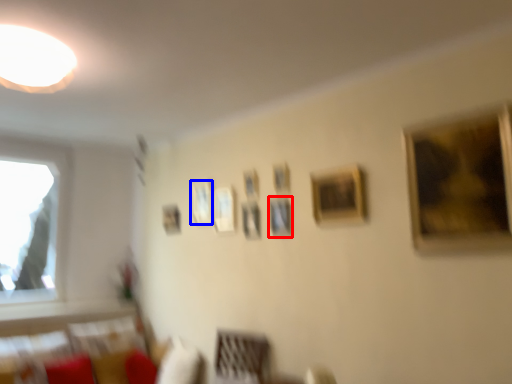
Question: Which point is further to the camera, picture frame (highlighted by a red box) or picture frame (highlighted by a blue box)?

Choices:
 (A) picture frame
 (B) picture frame

Answer: (B)